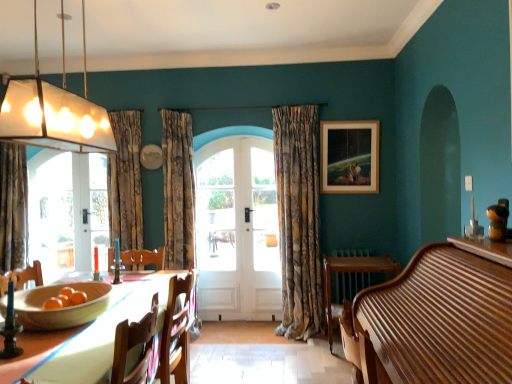
Question: Should I look upward or downward to see clear glass door at left?

Choices:
 (A) down
 (B) up

Answer: (A)

Question: Considering the relative sizes of white wood screen door at center and wooden table at lower left in the image provided, is white wood screen door at center wider than wooden table at lower left?

Choices:
 (A) yes
 (B) no

Answer: (B)

Question: Is white wood screen door at center further to camera compared to wooden table at lower left?

Choices:
 (A) no
 (B) yes

Answer: (B)

Question: Considering the relative positions of white wood screen door at center and wooden table at lower left in the image provided, is white wood screen door at center to the left of wooden table at lower left from the viewer's perspective?

Choices:
 (A) no
 (B) yes

Answer: (A)

Question: Is white wood screen door at center smaller than wooden table at lower left?

Choices:
 (A) no
 (B) yes

Answer: (B)

Question: Are white wood screen door at center and wooden table at lower left far apart?

Choices:
 (A) yes
 (B) no

Answer: (A)

Question: Is wooden table at lower left inside white wood screen door at center?

Choices:
 (A) yes
 (B) no

Answer: (B)

Question: Would you say clear glass door at left is a long distance from white wooden door at center?

Choices:
 (A) yes
 (B) no

Answer: (A)

Question: Does clear glass door at left come in front of white wooden door at center?

Choices:
 (A) yes
 (B) no

Answer: (B)

Question: Considering the relative sizes of clear glass door at left and white wooden door at center in the image provided, is clear glass door at left bigger than white wooden door at center?

Choices:
 (A) no
 (B) yes

Answer: (B)

Question: From the image's perspective, is clear glass door at left located beneath white wooden door at center?

Choices:
 (A) yes
 (B) no

Answer: (B)

Question: Is clear glass door at left next to white wooden door at center?

Choices:
 (A) yes
 (B) no

Answer: (B)

Question: Is clear glass door at left shorter than white wooden door at center?

Choices:
 (A) yes
 (B) no

Answer: (A)

Question: Is textured beige curtain at center, which is counted as the first curtain, starting from the right, in contact with translucent glass pendant light at upper left?

Choices:
 (A) yes
 (B) no

Answer: (B)